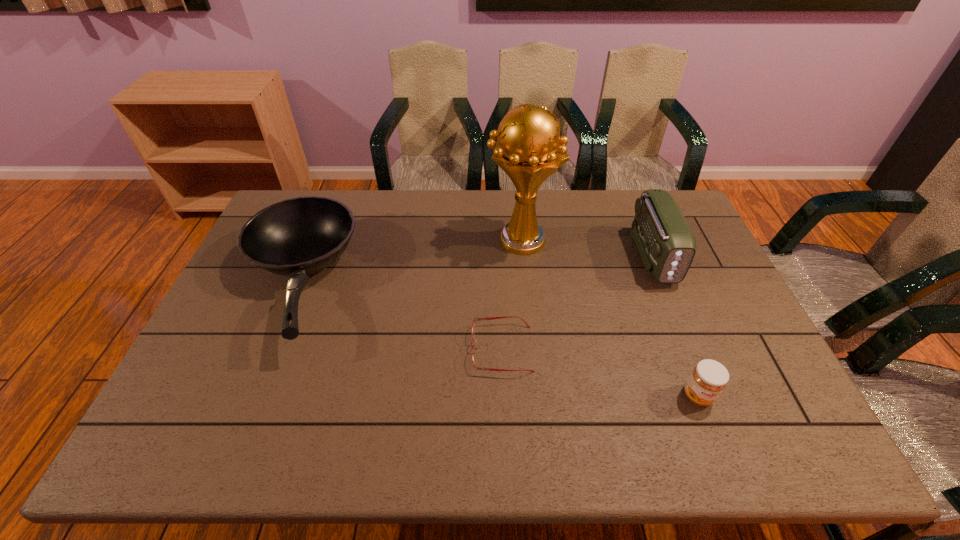
This screenshot has height=540, width=960. Find the location of `object that is at the right edge`. object that is at the right edge is located at coordinates click(x=666, y=243).

The image size is (960, 540). Identify the location of object that is at the far left corner. (296, 237).

The width and height of the screenshot is (960, 540). I want to click on object that is at the far right corner, so click(666, 243).

Locate an element on the screen. The image size is (960, 540). free location at the far edge is located at coordinates (478, 201).

Identify the location of free space at the near edge of the desktop. (646, 433).

Locate an element on the screen. Image resolution: width=960 pixels, height=540 pixels. free space at the left edge is located at coordinates (270, 282).

The image size is (960, 540). In the image, there is a desktop. Find the location of `vacant space at the right edge`. vacant space at the right edge is located at coordinates (718, 334).

You are a GUI agent. You are given a task and a screenshot of the screen. Output one action in this format:
    pyautogui.click(x=<x>, y=<y>)
    Task: Click on the empty space that is in between the jam and the third tallest object
    The width and height of the screenshot is (960, 540).
    Given the screenshot: What is the action you would take?
    pyautogui.click(x=497, y=340)

Find the location of `free space between the spectacles and the radio_receiver`. free space between the spectacles and the radio_receiver is located at coordinates (577, 302).

In order to click on unoccupied area between the leftmost object and the trophy_cup in this screenshot , I will do `click(409, 262)`.